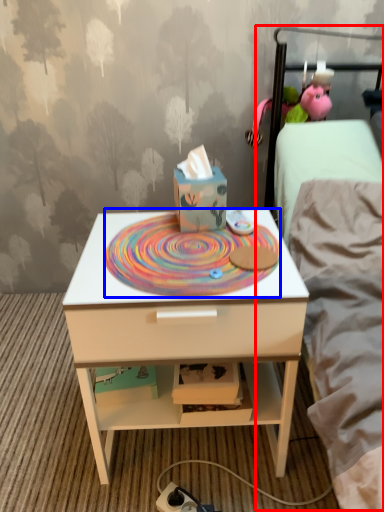
Question: Which object is closer to the camera taking this photo, bed (highlighted by a red box) or design (highlighted by a blue box)?

Choices:
 (A) bed
 (B) design

Answer: (B)